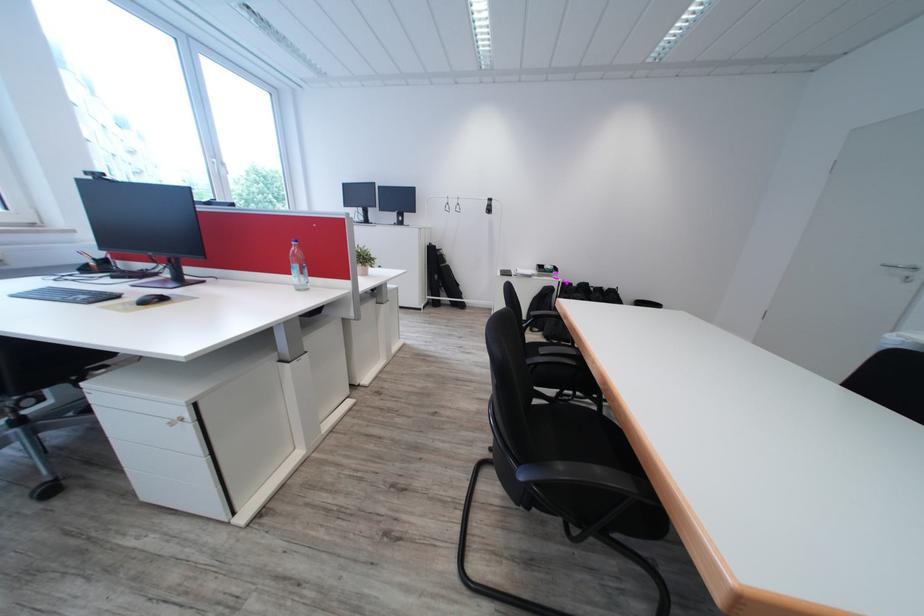
The width and height of the screenshot is (924, 616). Identify the location of metal coat hanger. (452, 205).